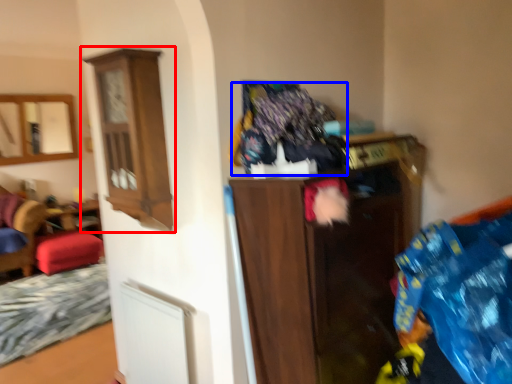
Question: Among these objects, which one is nearest to the camera, cabinetry (highlighted by a red box) or laundry (highlighted by a blue box)?

Choices:
 (A) cabinetry
 (B) laundry

Answer: (B)